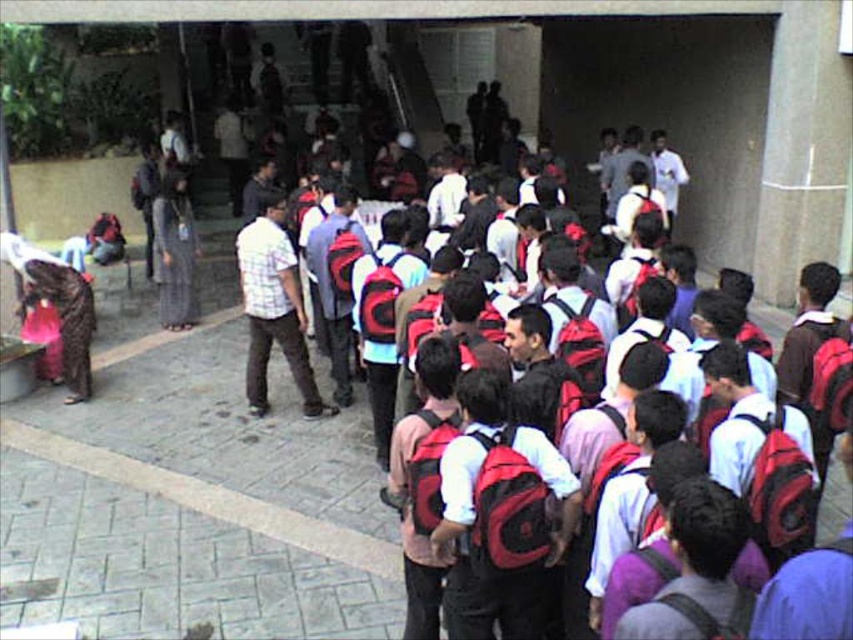
Question: Which is farther from the matte red backpack at center?

Choices:
 (A) gray concrete line at lower center
 (B) plaid shirt at center

Answer: (B)

Question: Which point is farther to the camera?

Choices:
 (A) (277, 337)
 (B) (26, 442)

Answer: (A)

Question: Can you confirm if matte red backpack at center is smaller than plaid shirt at center?

Choices:
 (A) no
 (B) yes

Answer: (B)

Question: Does gray concrete line at lower center come in front of plaid shirt at center?

Choices:
 (A) yes
 (B) no

Answer: (A)

Question: Which of the following is the farthest from the observer?

Choices:
 (A) gray concrete line at lower center
 (B) plaid shirt at center

Answer: (B)

Question: In this image, where is gray concrete line at lower center located relative to plaid shirt at center?

Choices:
 (A) below
 (B) above

Answer: (A)